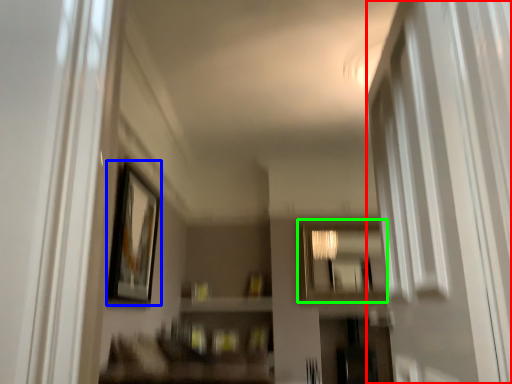
Question: Considering the real-world distances, which object is farthest from screen door (highlighted by a red box)? picture frame (highlighted by a blue box) or mirror (highlighted by a green box)?

Choices:
 (A) picture frame
 (B) mirror

Answer: (B)